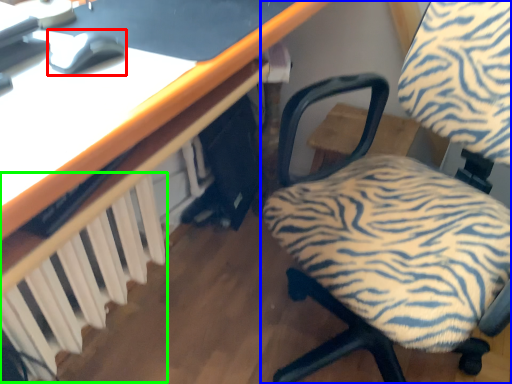
Question: Estimate the real-world distances between objects in this image. Which object is closer to mouse (highlighted by a red box), chair (highlighted by a blue box) or radiator (highlighted by a green box)?

Choices:
 (A) chair
 (B) radiator

Answer: (B)